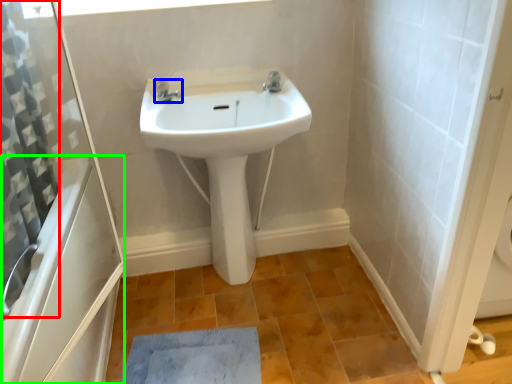
Question: Based on their relative distances, which object is nearer to shower curtain (highlighted by a red box)? Choose from tap (highlighted by a blue box) and bath (highlighted by a green box).

Choices:
 (A) tap
 (B) bath

Answer: (B)